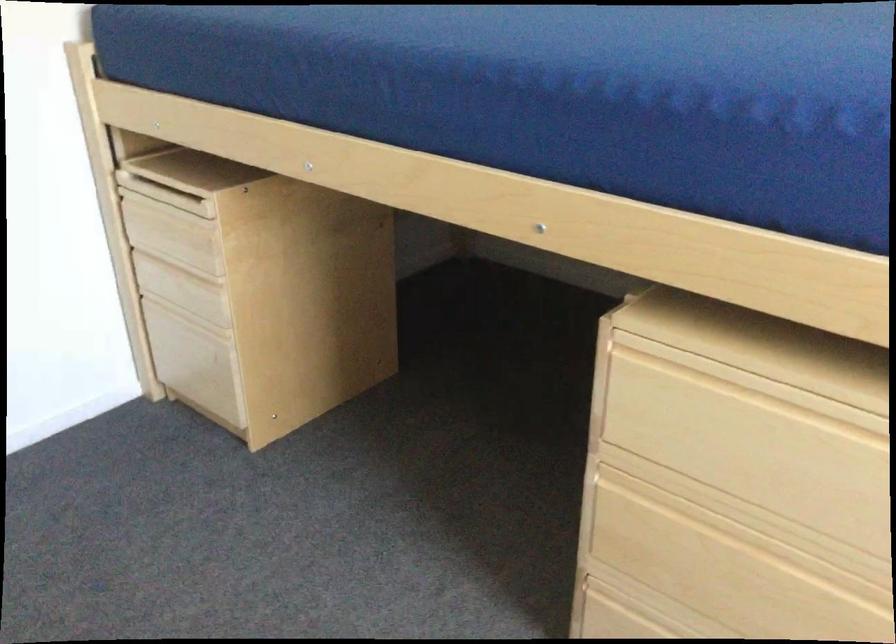
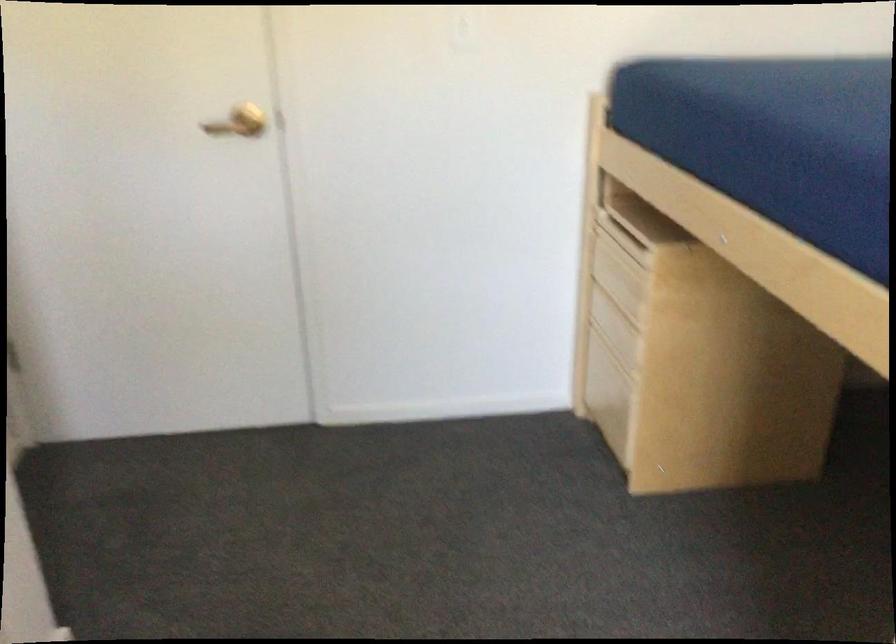
Question: The images are taken continuously from a first-person perspective. In which direction is your viewpoint rotating?

Choices:
 (A) Left
 (B) Right
 (C) Up
 (D) Down

Answer: (A)